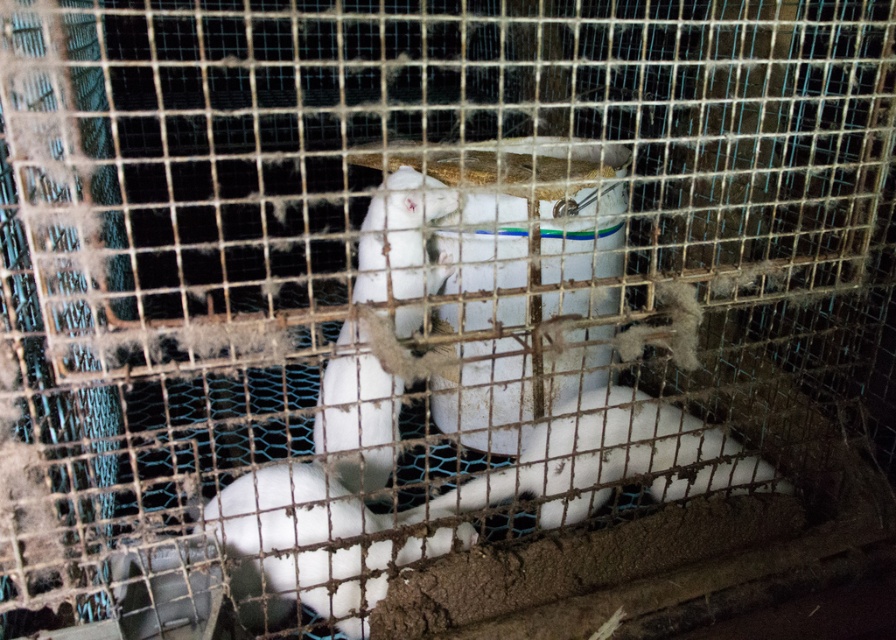
Question: Where is white fluffy rabbit at center located in relation to white fur animal at center in the image?

Choices:
 (A) above
 (B) below

Answer: (B)

Question: Which object appears closest to the camera in this image?

Choices:
 (A) white fluffy rabbit at center
 (B) white fur animal at center
 (C) white fur rabbit at center

Answer: (B)

Question: Observing the image, what is the correct spatial positioning of white fluffy rabbit at center in reference to white fur animal at center?

Choices:
 (A) right
 (B) left

Answer: (B)

Question: Which object appears farthest from the camera in this image?

Choices:
 (A) white fluffy rabbit at center
 (B) white fur animal at center

Answer: (A)

Question: Which point is farther to the camera?

Choices:
 (A) white fur rabbit at center
 (B) white fur animal at center

Answer: (A)

Question: Can you confirm if white fluffy rabbit at center is bigger than white fur animal at center?

Choices:
 (A) yes
 (B) no

Answer: (B)